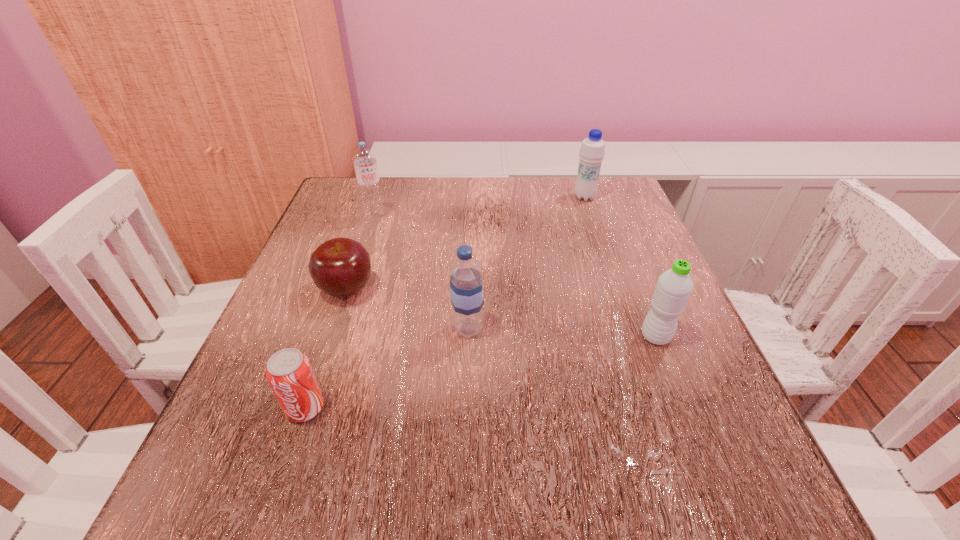
Image resolution: width=960 pixels, height=540 pixels. In order to click on vacant space located on the logo side of the nearest object in this screenshot , I will do `click(275, 497)`.

This screenshot has width=960, height=540. Identify the location of water bottle at the left edge. (364, 159).

The width and height of the screenshot is (960, 540). What are the coordinates of `apple that is at the left edge` in the screenshot? It's located at (340, 267).

Where is `soda can situated at the left edge`? soda can situated at the left edge is located at coordinates (289, 373).

The image size is (960, 540). In order to click on object present at the far left corner in this screenshot , I will do `click(364, 159)`.

Locate an element on the screen. object located in the far right corner section of the desktop is located at coordinates (592, 151).

Find the location of a particular element. free spot at the far edge of the desktop is located at coordinates tap(429, 185).

Identify the location of free region at the near edge of the desktop. The width and height of the screenshot is (960, 540). (553, 511).

Locate an element on the screen. The height and width of the screenshot is (540, 960). vacant space at the left edge of the desktop is located at coordinates (324, 407).

I want to click on vacant space at the right edge of the desktop, so click(653, 399).